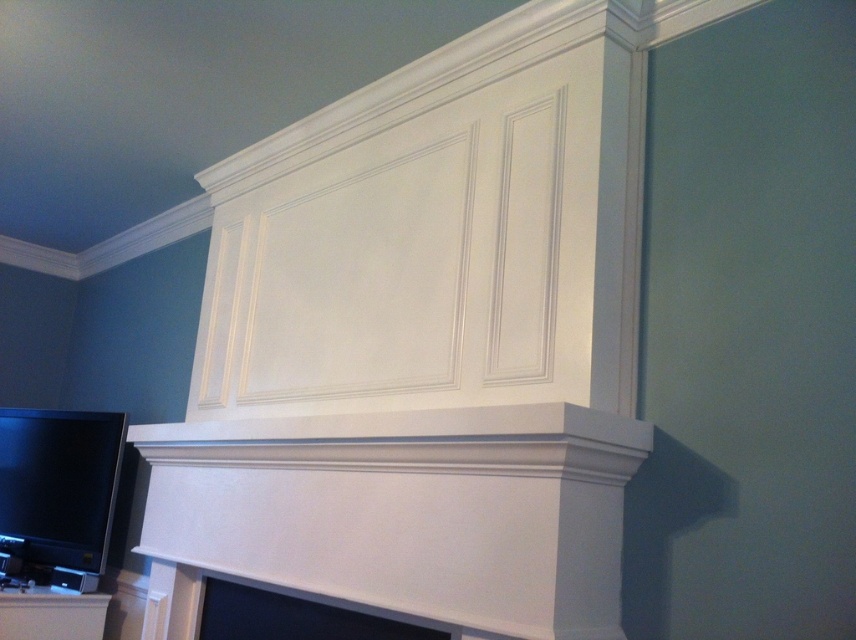
Question: Which of the following is the closest to the observer?

Choices:
 (A) matte black flat screen tv at lower left
 (B) matte white fireplace at lower center

Answer: (B)

Question: Is matte black flat screen tv at lower left further to camera compared to matte white fireplace at lower center?

Choices:
 (A) yes
 (B) no

Answer: (A)

Question: Which point is farther to the camera?

Choices:
 (A) (42, 561)
 (B) (242, 588)

Answer: (A)

Question: Can you confirm if matte black flat screen tv at lower left is positioned to the right of matte white fireplace at lower center?

Choices:
 (A) yes
 (B) no

Answer: (B)

Question: Can you confirm if matte black flat screen tv at lower left is thinner than matte white fireplace at lower center?

Choices:
 (A) no
 (B) yes

Answer: (B)